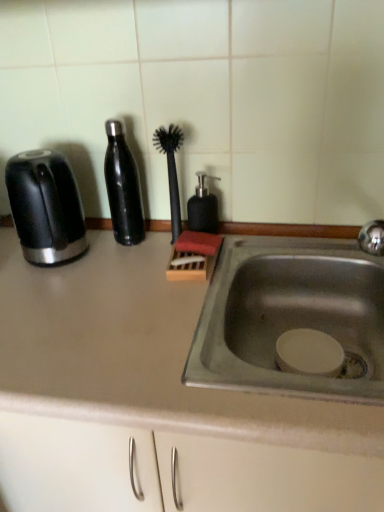
Identify the location of vacant area that lies to the right of black glossy toaster at left. (119, 260).